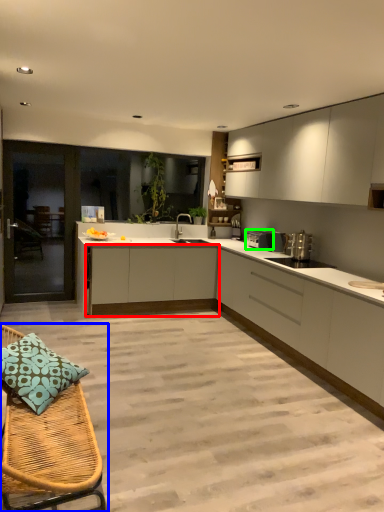
Question: Based on their relative distances, which object is nearer to cabinetry (highlighted by a red box)? Choose from furniture (highlighted by a blue box) and appliance (highlighted by a green box).

Choices:
 (A) furniture
 (B) appliance

Answer: (B)